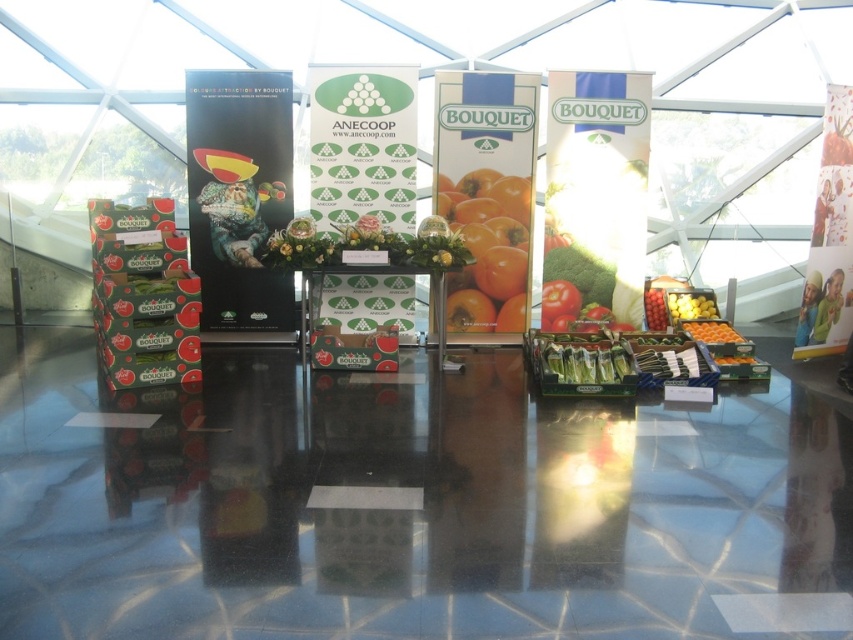
Question: Is yellow matte cherry tomatoes at center smaller than orange matte at right?

Choices:
 (A) yes
 (B) no

Answer: (A)

Question: Among these objects, which one is farthest from the camera?

Choices:
 (A) green matte tomato at center
 (B) yellow matte cherry tomatoes at center

Answer: (A)

Question: In this image, where is yellow matte cherry tomatoes at center located relative to green matte tomato at center?

Choices:
 (A) right
 (B) left

Answer: (A)

Question: Which object is the closest to the smooth orange tomato at center?

Choices:
 (A) orange matte at right
 (B) green matte tomato at center
 (C) yellow matte cherry tomatoes at center

Answer: (B)

Question: Among these points, which one is nearest to the camera?

Choices:
 (A) (618, 346)
 (B) (508, 300)
 (C) (743, 339)
 (D) (677, 301)

Answer: (A)

Question: Is green glossy asparagus at center below yellow matte cherry tomatoes at center?

Choices:
 (A) yes
 (B) no

Answer: (A)